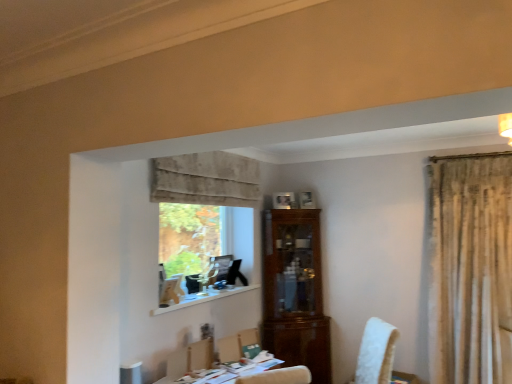
Question: Is green fabric chair at center taller than light brown wooden armchair at lower center?

Choices:
 (A) yes
 (B) no

Answer: (B)

Question: From a real-world perspective, is green fabric chair at center located beneath light brown wooden armchair at lower center?

Choices:
 (A) yes
 (B) no

Answer: (B)

Question: From a real-world perspective, is green fabric chair at center positioned over light brown wooden armchair at lower center based on gravity?

Choices:
 (A) no
 (B) yes

Answer: (B)

Question: Does green fabric chair at center appear on the right side of light brown wooden armchair at lower center?

Choices:
 (A) no
 (B) yes

Answer: (B)

Question: Is green fabric chair at center facing away from light brown wooden armchair at lower center?

Choices:
 (A) yes
 (B) no

Answer: (B)

Question: Is green fabric chair at center directly adjacent to light brown wooden armchair at lower center?

Choices:
 (A) yes
 (B) no

Answer: (B)

Question: Is white glossy table at lower center wider than beige velvet curtain at upper center?

Choices:
 (A) no
 (B) yes

Answer: (B)

Question: From a real-world perspective, is white glossy table at lower center physically above beige velvet curtain at upper center?

Choices:
 (A) yes
 (B) no

Answer: (B)

Question: Does white glossy table at lower center have a lesser height compared to beige velvet curtain at upper center?

Choices:
 (A) yes
 (B) no

Answer: (A)

Question: From the image's perspective, is white glossy table at lower center above beige velvet curtain at upper center?

Choices:
 (A) no
 (B) yes

Answer: (A)

Question: Is white glossy table at lower center not close to beige velvet curtain at upper center?

Choices:
 (A) no
 (B) yes

Answer: (B)

Question: Can you confirm if white glossy table at lower center is positioned to the left of beige velvet curtain at upper center?

Choices:
 (A) no
 (B) yes

Answer: (A)

Question: Considering the relative positions of light brown wooden armchair at lower center and green fabric chair at center in the image provided, is light brown wooden armchair at lower center in front of green fabric chair at center?

Choices:
 (A) yes
 (B) no

Answer: (A)